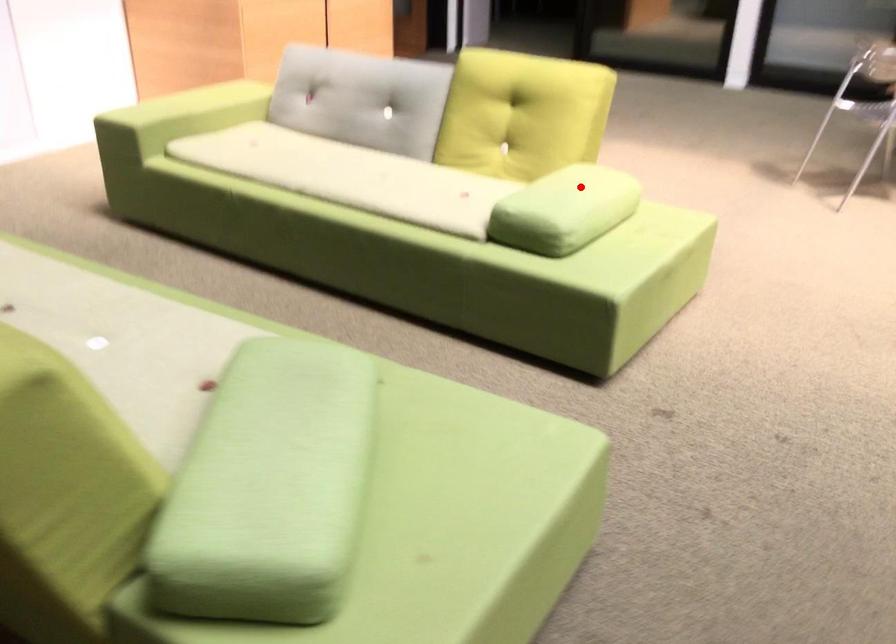
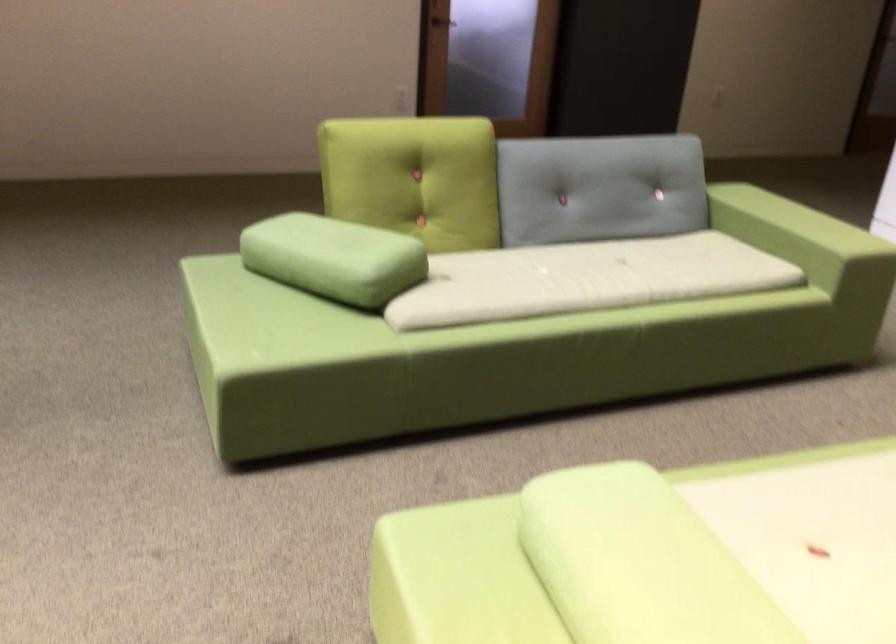
The point at the highlighted location is marked in the first image. Where is the corresponding point in the second image?

(639, 563)